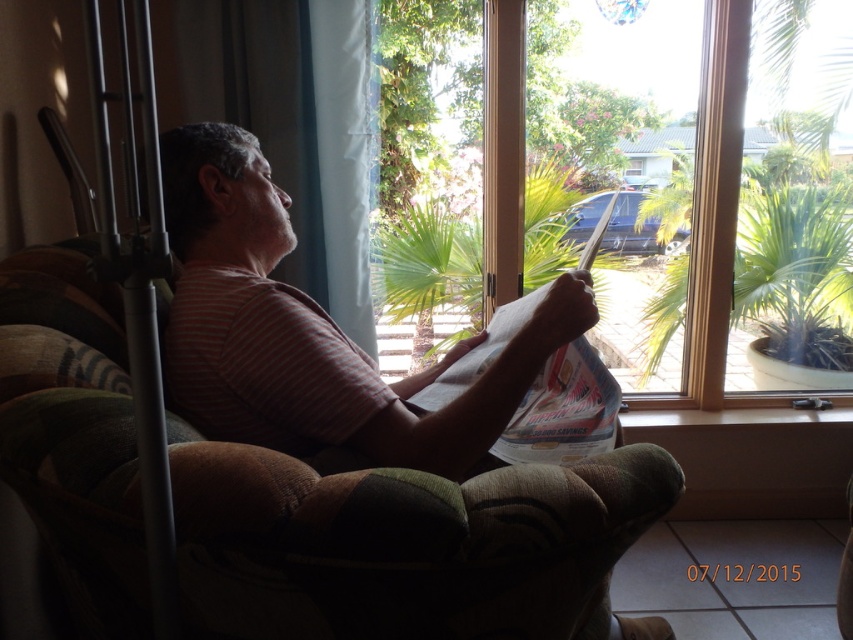
You are a delivery person standing outside the house. You see the clear glass window at center and the striped cotton shirt at center through the window. Which object is closer to you?

The clear glass window at center is closer to you because it is positioned over the striped cotton shirt at center, meaning the window is in front of the shirt from your perspective outside.